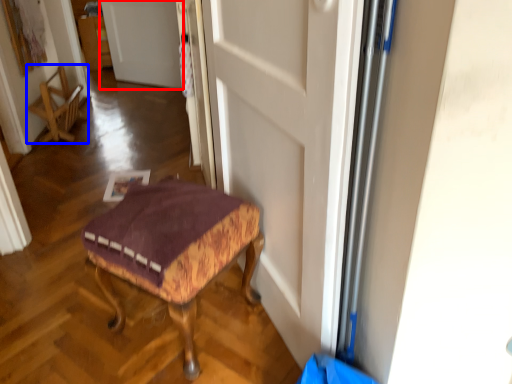
Question: Which point is closer to the camera, door (highlighted by a red box) or chair (highlighted by a blue box)?

Choices:
 (A) door
 (B) chair

Answer: (B)